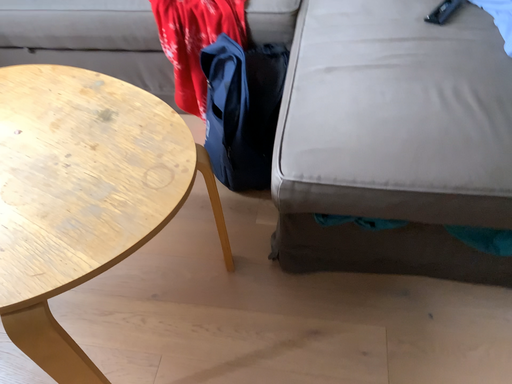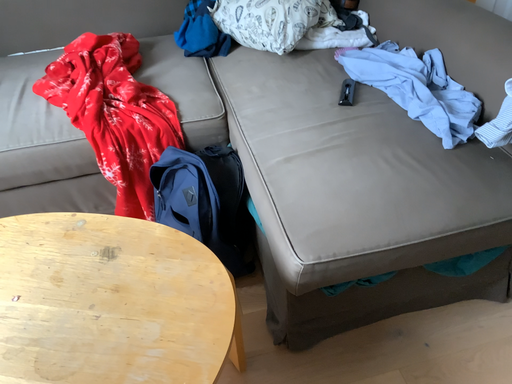
Question: How did the camera likely rotate when shooting the video?

Choices:
 (A) rotated left
 (B) rotated right

Answer: (B)